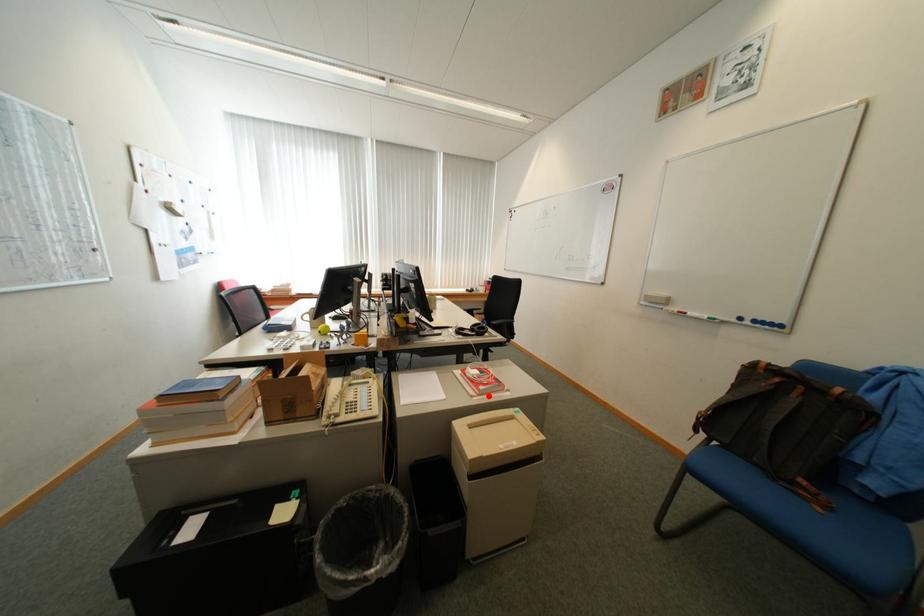
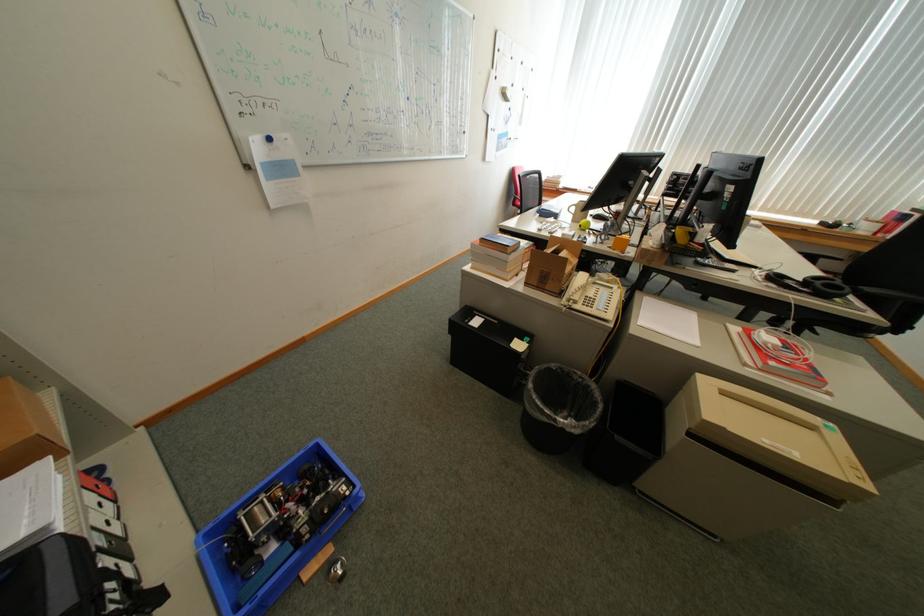
Find the pixel in the second image that matches the highlighted location in the first image.

(770, 371)